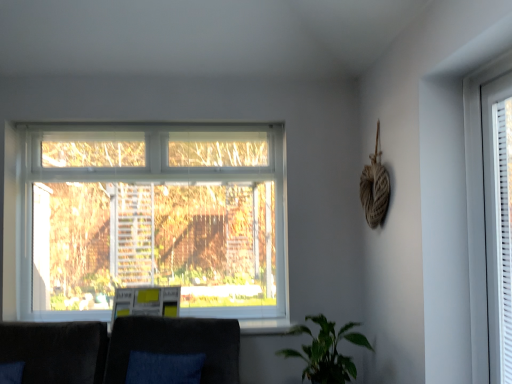
Question: Is green matte plant at lower right outside of white plastic window at right?

Choices:
 (A) no
 (B) yes

Answer: (B)

Question: From a real-world perspective, does green matte plant at lower right stand above white plastic window at right?

Choices:
 (A) yes
 (B) no

Answer: (B)

Question: Considering the relative sizes of green matte plant at lower right and white plastic window at right in the image provided, is green matte plant at lower right bigger than white plastic window at right?

Choices:
 (A) yes
 (B) no

Answer: (A)

Question: Are green matte plant at lower right and white plastic window at right making contact?

Choices:
 (A) yes
 (B) no

Answer: (B)

Question: From the image's perspective, does green matte plant at lower right appear lower than white plastic window at right?

Choices:
 (A) no
 (B) yes

Answer: (B)

Question: Considering the relative positions of green matte plant at lower right and white plastic window at right in the image provided, is green matte plant at lower right to the left of white plastic window at right from the viewer's perspective?

Choices:
 (A) no
 (B) yes

Answer: (B)

Question: Is white plastic window at right wider than green matte plant at lower right?

Choices:
 (A) no
 (B) yes

Answer: (A)

Question: Can you confirm if white plastic window at right is positioned to the right of green matte plant at lower right?

Choices:
 (A) yes
 (B) no

Answer: (A)

Question: Is white plastic window at right in front of green matte plant at lower right?

Choices:
 (A) no
 (B) yes

Answer: (B)

Question: From a real-world perspective, is white plastic window at right positioned under green matte plant at lower right based on gravity?

Choices:
 (A) no
 (B) yes

Answer: (A)

Question: Is white plastic window at right with green matte plant at lower right?

Choices:
 (A) no
 (B) yes

Answer: (A)

Question: Does white plastic window at right have a larger size compared to green matte plant at lower right?

Choices:
 (A) no
 (B) yes

Answer: (A)

Question: Is green matte plant at lower right in front of velvet dark gray couch at lower center?

Choices:
 (A) no
 (B) yes

Answer: (A)